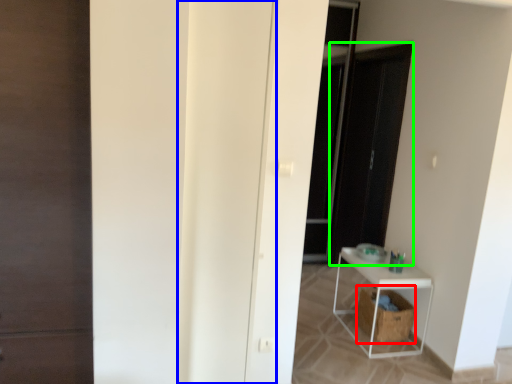
Question: Considering the real-world distances, which object is closest to laundry basket (highlighted by a red box)? door (highlighted by a blue box) or screen door (highlighted by a green box).

Choices:
 (A) door
 (B) screen door

Answer: (B)